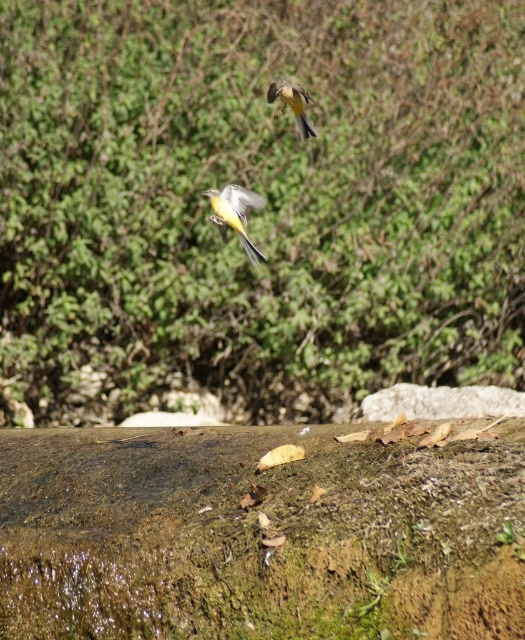
Measure the distance between point (x=239, y=204) and camera.

They are 4.97 meters apart.

Which of these two, yellow matte bird at center or yellow-green feathers at upper center, stands taller?

Standing taller between the two is yellow matte bird at center.

Describe the element at coordinates (235, 212) in the screenshot. I see `yellow matte bird at center` at that location.

Locate an element on the screen. This screenshot has width=525, height=640. yellow matte bird at center is located at coordinates (235, 212).

Find the location of a particular element. The width and height of the screenshot is (525, 640). mossy rock at lower center is located at coordinates (441, 403).

The width and height of the screenshot is (525, 640). In order to click on mossy rock at lower center in this screenshot , I will do `click(441, 403)`.

Can you confirm if mossy rock at lower center is bigger than yellow-green feathers at upper center?

Yes, mossy rock at lower center is bigger than yellow-green feathers at upper center.

Identify the location of mossy rock at lower center. (441, 403).